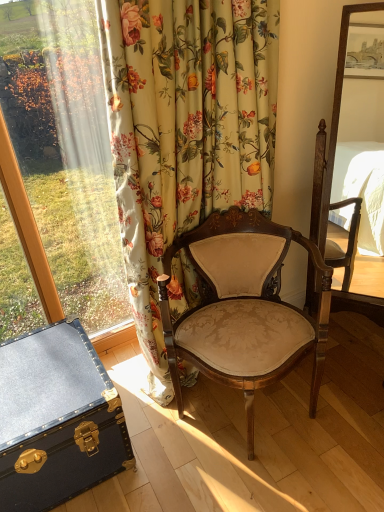
Question: From the image's perspective, is floral fabric curtain at left above or below blue leather trunk at lower left?

Choices:
 (A) below
 (B) above

Answer: (B)

Question: Is floral fabric curtain at left inside the boundaries of blue leather trunk at lower left, or outside?

Choices:
 (A) outside
 (B) inside

Answer: (A)

Question: Based on their relative distances, which object is nearer to the floral fabric curtain at left?

Choices:
 (A) blue leather trunk at lower left
 (B) matte beige fabric chair at center

Answer: (B)

Question: Which object is positioned closest to the matte beige fabric chair at center?

Choices:
 (A) blue leather trunk at lower left
 (B) floral fabric curtain at left

Answer: (B)